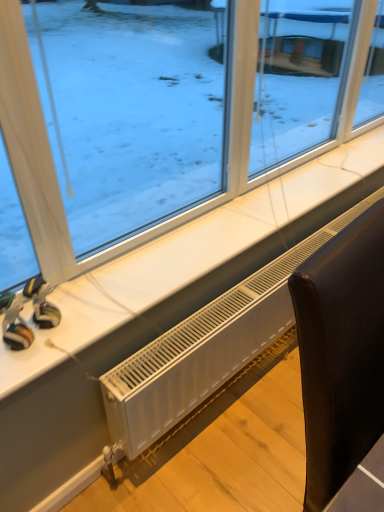
Find the location of a particular element. vacant space to the right of matte plastic toy at lower left, the 2th toy viewed from the left is located at coordinates (99, 312).